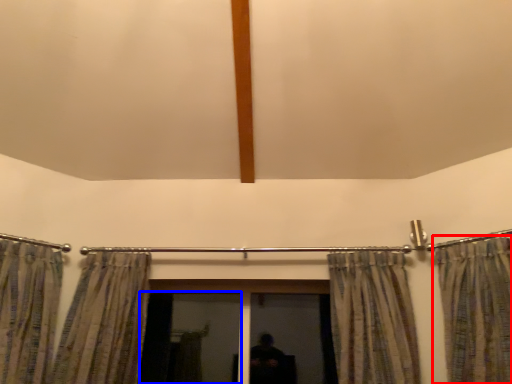
Question: Which object appears farthest to the camera in this image, curtain (highlighted by a red box) or screen door (highlighted by a blue box)?

Choices:
 (A) curtain
 (B) screen door

Answer: (B)